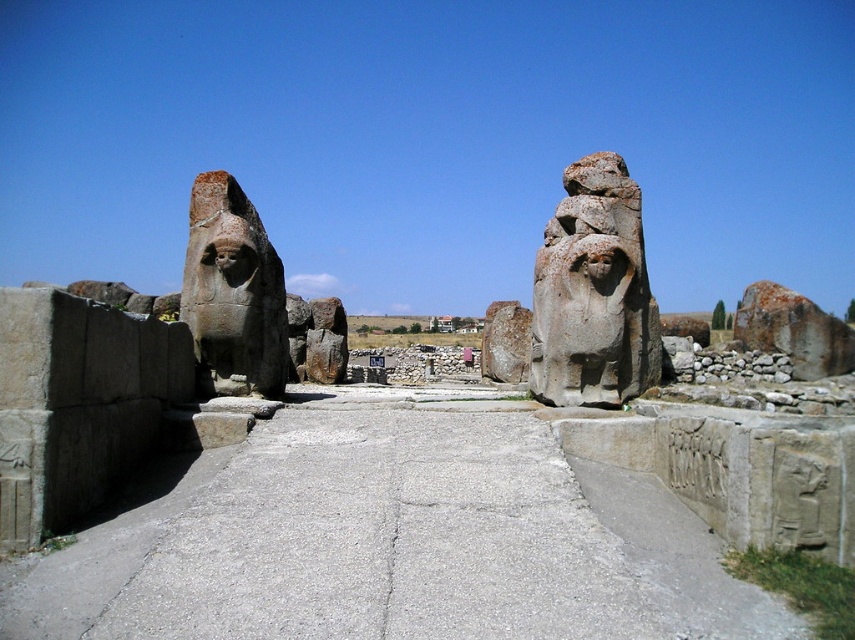
Can you confirm if gray stone lion at center is wider than brown stone statue at left?

Yes.

Between point (650, 356) and point (239, 236), which one is positioned in front?

Point (239, 236)

Locate an element on the screen. This screenshot has height=640, width=855. gray stone lion at center is located at coordinates (593, 292).

Who is more forward, [323,621] or [245,275]?

Positioned in front is point [323,621].

Can you confirm if gray concrete pavement at center is positioned below brown stone statue at left?

Indeed, gray concrete pavement at center is positioned under brown stone statue at left.

What do you see at coordinates (394, 545) in the screenshot? I see `gray concrete pavement at center` at bounding box center [394, 545].

The image size is (855, 640). In order to click on gray concrete pavement at center in this screenshot , I will do `click(394, 545)`.

Between gray concrete pavement at center and brown stone statue at center, which one has less height?

gray concrete pavement at center is shorter.

Which of these two, gray concrete pavement at center or brown stone statue at center, stands taller?

With more height is brown stone statue at center.

Between point (581, 596) and point (313, 317), which one is positioned behind?

Positioned behind is point (313, 317).

Where is `gray concrete pavement at center`? gray concrete pavement at center is located at coordinates [x=394, y=545].